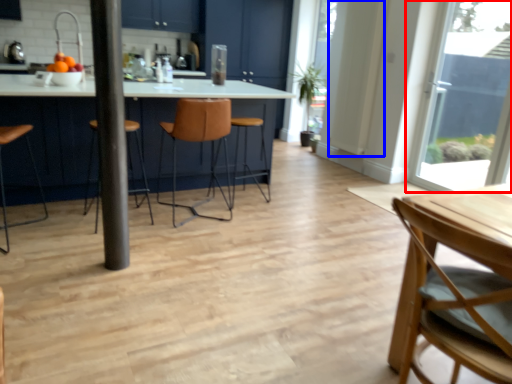
Question: Which of the following is the closest to the observer, window (highlighted by a red box) or door (highlighted by a blue box)?

Choices:
 (A) window
 (B) door

Answer: (A)